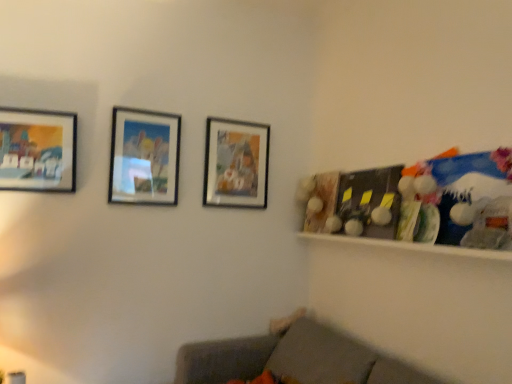
Question: Would you say matte glass picture frame at center, which appears as the 2th picture frame when viewed from the back, is inside or outside gray fabric couch at lower center?

Choices:
 (A) outside
 (B) inside

Answer: (A)

Question: From the image's perspective, is matte glass picture frame at center, which is counted as the second picture frame, starting from the left, positioned above or below gray fabric couch at lower center?

Choices:
 (A) above
 (B) below

Answer: (A)

Question: Based on their relative distances, which object is farther from the gray fabric couch at lower center?

Choices:
 (A) matte wooden picture frame at center, which is counted as the 3th picture frame, starting from the front
 (B) matte glass picture frame at center, which is counted as the second picture frame, starting from the left
 (C) white glossy shelf at right
 (D) matte wooden picture frame at left, which appears as the third picture frame when viewed from the back

Answer: (D)

Question: Which object is the closest to the matte wooden picture frame at left, the first picture frame when ordered from left to right?

Choices:
 (A) white glossy shelf at right
 (B) gray fabric couch at lower center
 (C) matte glass picture frame at center, acting as the 2th picture frame starting from the front
 (D) matte wooden picture frame at center, which is counted as the 3th picture frame, starting from the front

Answer: (C)